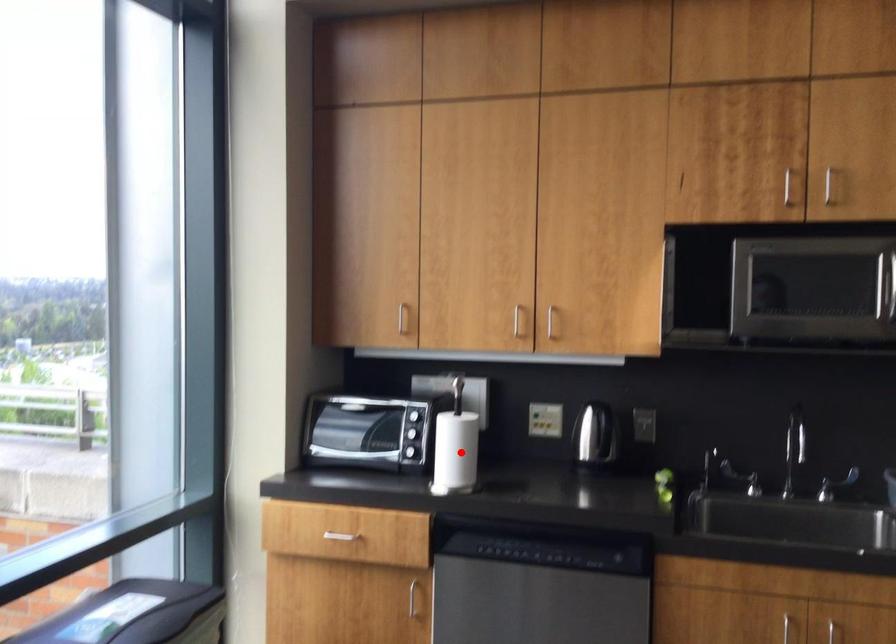
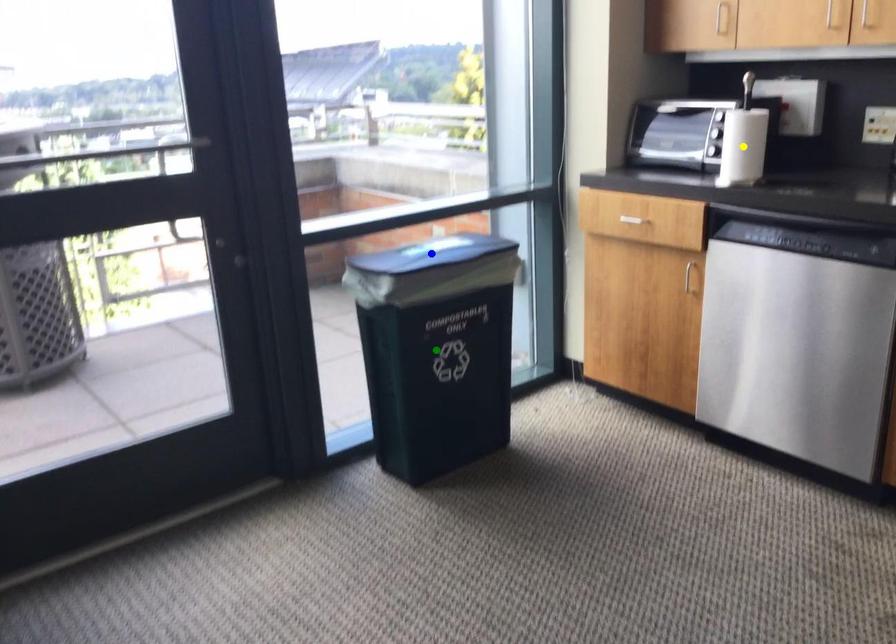
Question: I am providing you with two images of the same scene from different viewpoints. A red point is marked on the first image. You are given multiple points on the second image. In image 2, which mark is for the same physical point as the one in image 1?

Choices:
 (A) yellow point
 (B) blue point
 (C) green point

Answer: (A)